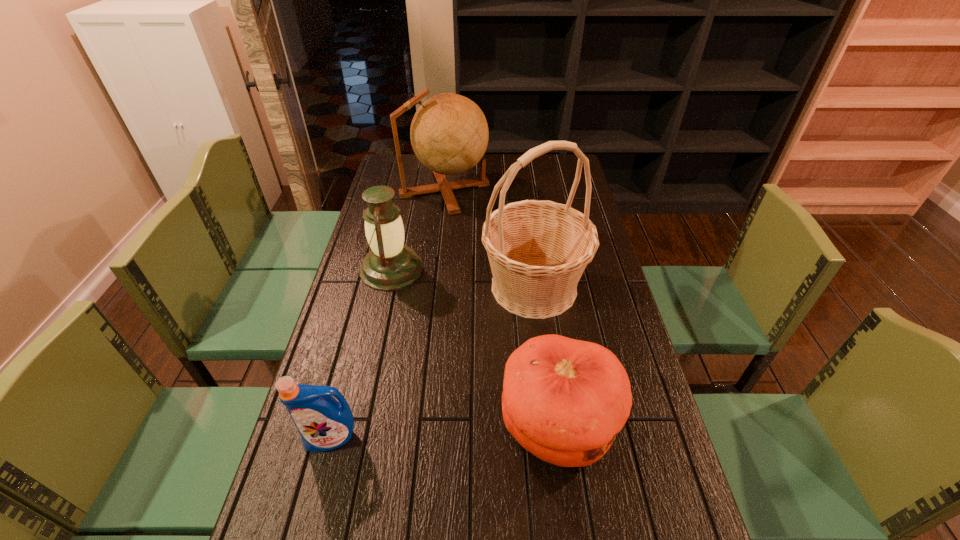
The image size is (960, 540). I want to click on free region located 0.120m on the label of the detergent, so click(x=313, y=509).

The width and height of the screenshot is (960, 540). Find the location of `object located at the far edge`. object located at the far edge is located at coordinates (449, 134).

The height and width of the screenshot is (540, 960). Find the location of `globe that is at the left edge`. globe that is at the left edge is located at coordinates (449, 134).

This screenshot has width=960, height=540. What are the coordinates of `lantern positioned at the left edge` in the screenshot? It's located at (390, 265).

Find the location of a particular element. This screenshot has height=540, width=960. detergent that is at the left edge is located at coordinates (324, 424).

The width and height of the screenshot is (960, 540). I want to click on basket present at the right edge, so click(x=538, y=250).

You are a GUI agent. You are given a task and a screenshot of the screen. Output one action in this format:
    pyautogui.click(x=<x>, y=<y>)
    Task: Click on the pumpkin positioned at the right edge
    This screenshot has height=540, width=960.
    Given the screenshot: What is the action you would take?
    pyautogui.click(x=564, y=400)

Locate an element on the screen. This screenshot has width=960, height=540. object located in the far left corner section of the desktop is located at coordinates (449, 134).

The width and height of the screenshot is (960, 540). In the image, there is a desktop. In order to click on vacant space at the far edge in this screenshot , I will do `click(520, 179)`.

Find the location of `free space at the left edge of the desktop`. free space at the left edge of the desktop is located at coordinates (297, 515).